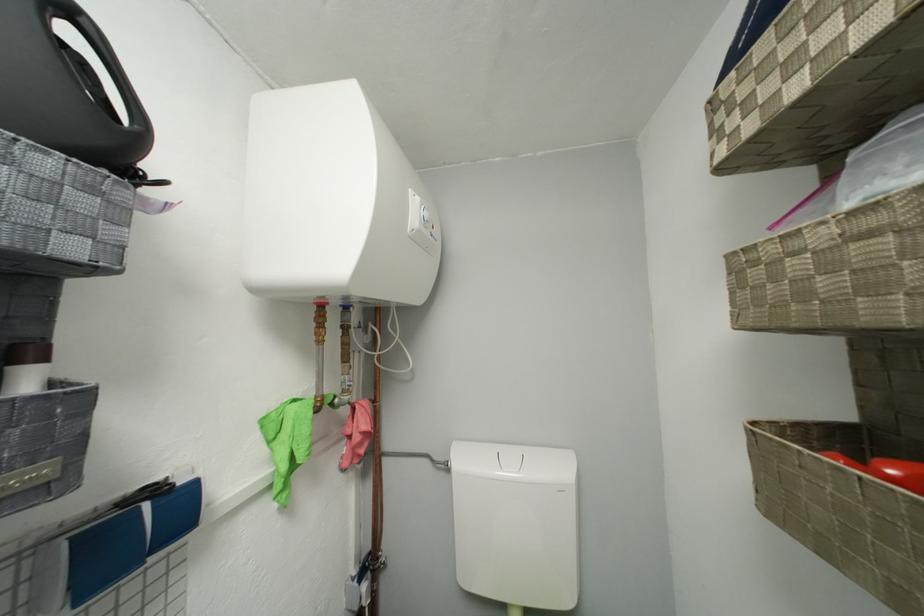
This screenshot has height=616, width=924. What do you see at coordinates (128, 541) in the screenshot?
I see `a blue valve handle` at bounding box center [128, 541].